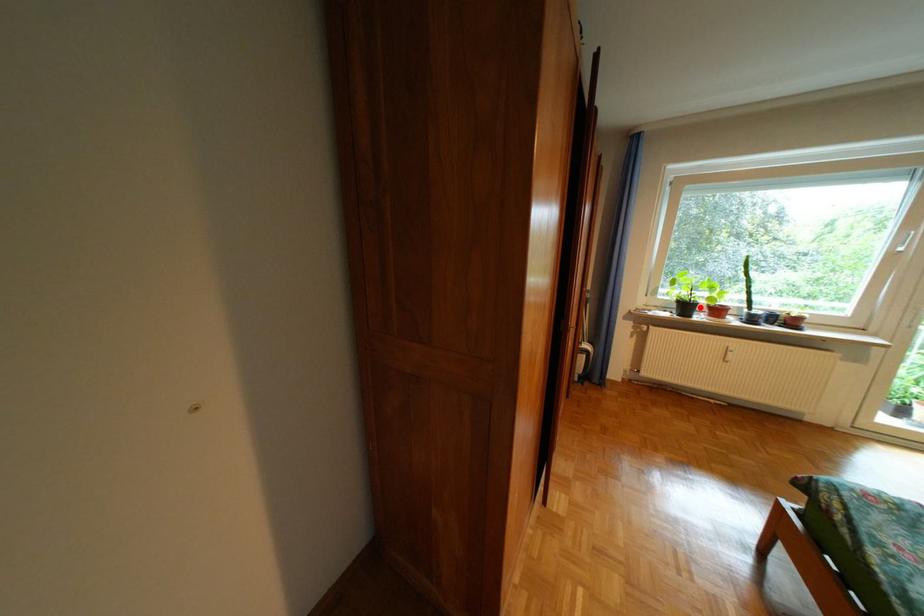
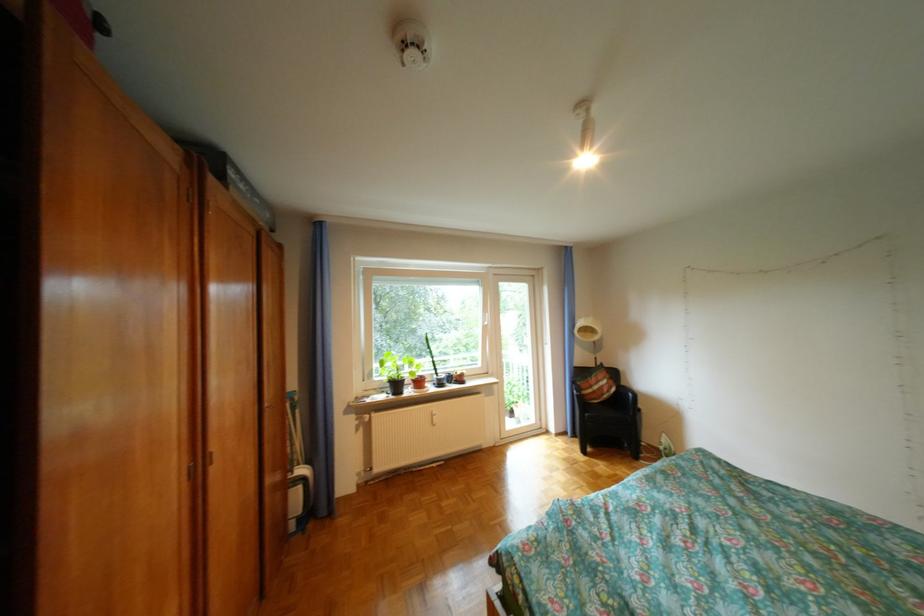
Question: I am providing you with two images of the same scene from different viewpoints. In image1, a red point is highlighted. Considering the same 3D point in image2, which of the following is correct?

Choices:
 (A) It is closer
 (B) It is farther

Answer: (B)